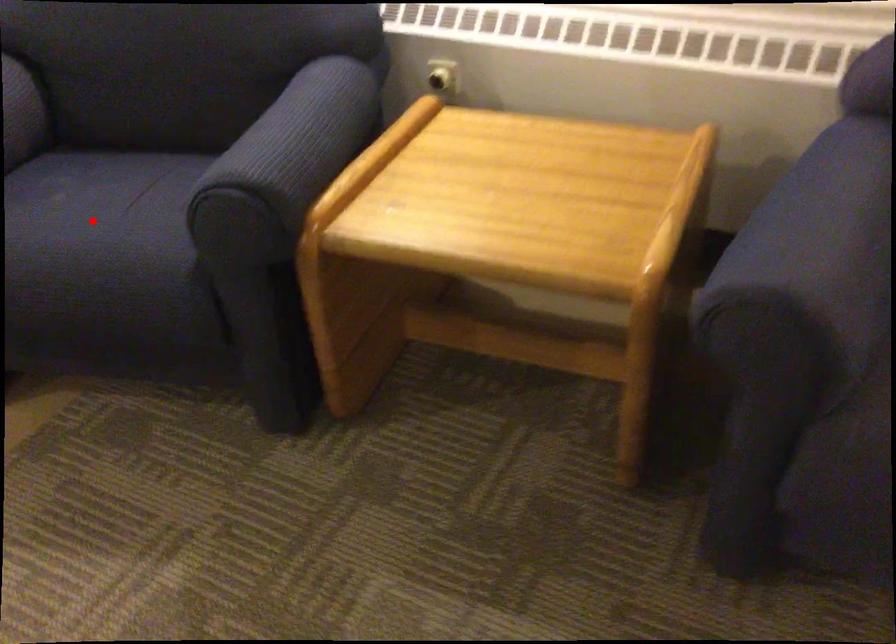
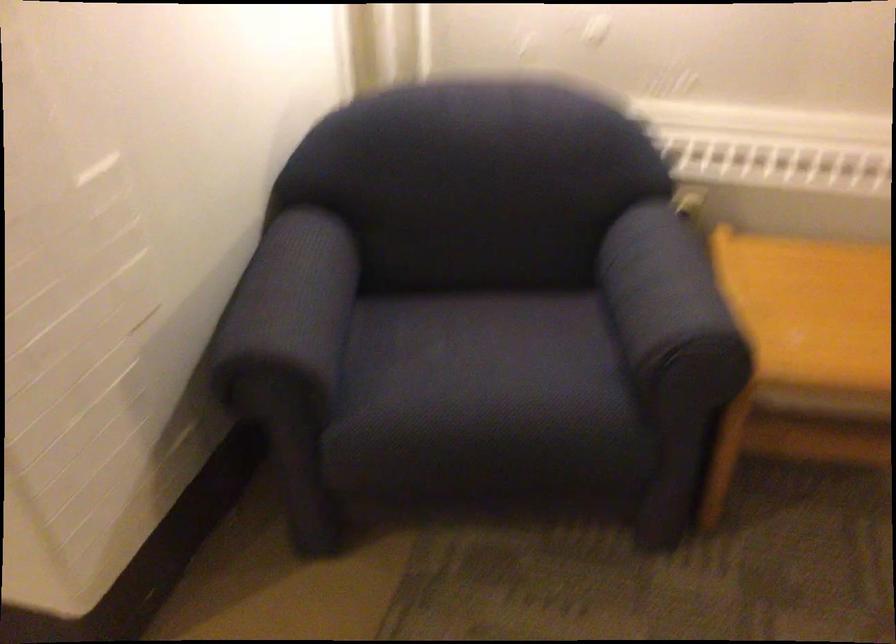
The point at the highlighted location is marked in the first image. Where is the corresponding point in the second image?

(485, 366)